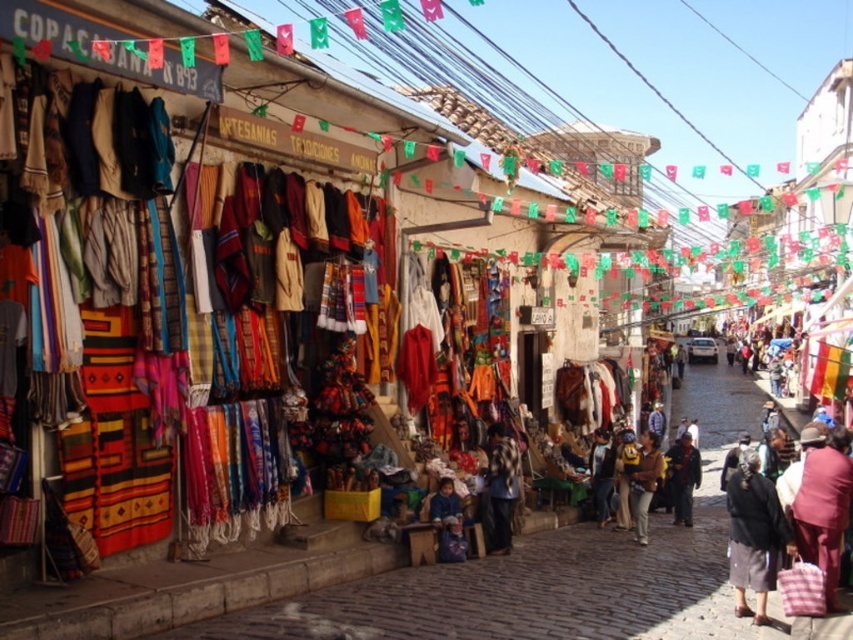
Question: Which is farther from the checkered fabric at center?

Choices:
 (A) dark blue jacket at center
 (B) pink fabric bag at lower right
 (C) dark brown fabric skirt at lower right
 (D) brown leather jacket at center

Answer: (B)

Question: Is checkered fabric at center thinner than dark blue jacket at center?

Choices:
 (A) yes
 (B) no

Answer: (A)

Question: Among these objects, which one is nearest to the camera?

Choices:
 (A) brown leather jacket at center
 (B) dark blue jacket at center
 (C) checkered fabric at center
 (D) pink fabric bag at lower right

Answer: (D)

Question: Can you confirm if checkered fabric at center is smaller than brown leather jacket at center?

Choices:
 (A) yes
 (B) no

Answer: (A)

Question: Where is pink fabric bag at lower right located in relation to brown leather jacket at center in the image?

Choices:
 (A) above
 (B) below

Answer: (A)

Question: Based on their relative distances, which object is nearer to the dark brown fabric skirt at lower right?

Choices:
 (A) checkered fabric at center
 (B) brown leather jacket at center

Answer: (B)